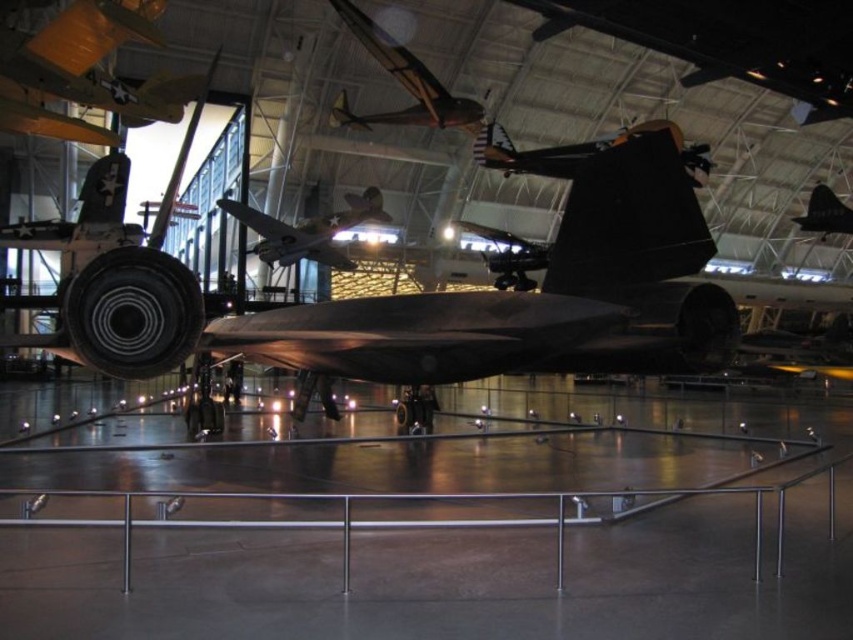
Does point (489, 268) come closer to viewer compared to point (825, 208)?

Yes, it is.

Between shiny black aircraft at center and shiny black airplane at center, which one has less height?

shiny black airplane at center

The width and height of the screenshot is (853, 640). What do you see at coordinates (509, 257) in the screenshot? I see `shiny black aircraft at center` at bounding box center [509, 257].

Where is `shiny black aircraft at center`? shiny black aircraft at center is located at coordinates (509, 257).

Is shiny metallic airplane at upper center to the right of shiny black aircraft at center from the viewer's perspective?

Incorrect, shiny metallic airplane at upper center is not on the right side of shiny black aircraft at center.

Is shiny metallic airplane at upper center below shiny black aircraft at center?

Incorrect, shiny metallic airplane at upper center is not positioned below shiny black aircraft at center.

Which is in front, point (445, 104) or point (529, 268)?

Point (445, 104) is more forward.

In order to click on shiny metallic airplane at upper center in this screenshot , I will do `click(402, 83)`.

Is shiny silver airplane at center above shiny black airplane at center?

Incorrect, shiny silver airplane at center is not positioned above shiny black airplane at center.

Describe the element at coordinates (308, 230) in the screenshot. I see `shiny silver airplane at center` at that location.

Find the location of `shiny silver airplane at center`. shiny silver airplane at center is located at coordinates (308, 230).